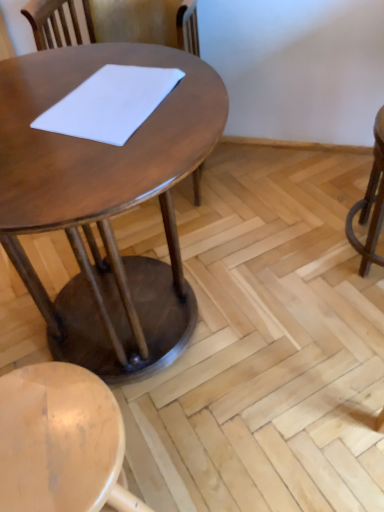
The width and height of the screenshot is (384, 512). I want to click on vacant space situated above white matte notepad at center (from a real-world perspective), so click(123, 84).